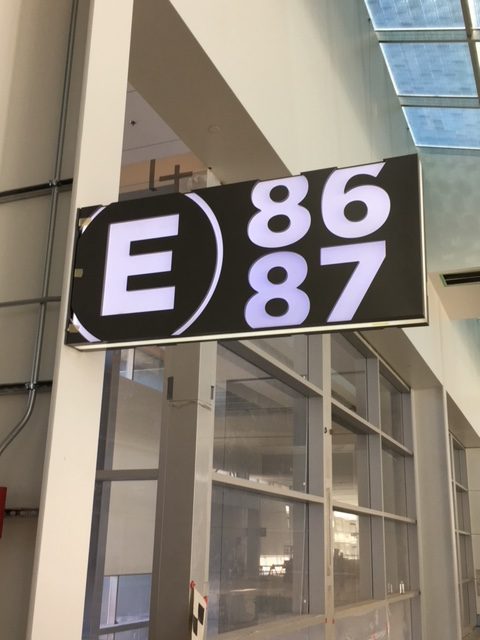
Locate an element on the screen. The width and height of the screenshot is (480, 640). cieling tiles is located at coordinates (392, 13), (430, 82), (440, 129).